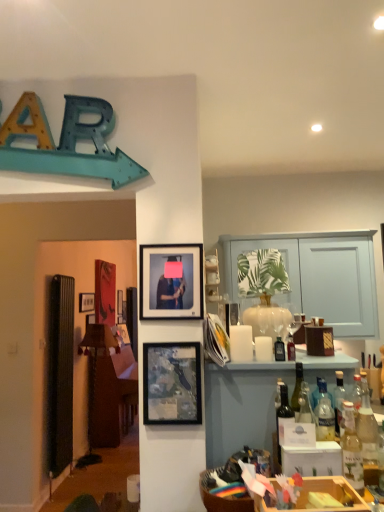
Question: Can you confirm if translucent glass bottles at right is taller than translucent glass bottle at right, which appears as the 4th bottle when viewed from the back?

Choices:
 (A) no
 (B) yes

Answer: (B)

Question: Considering the relative positions of translucent glass bottles at right and translucent glass bottle at right, which appears as the 4th bottle when viewed from the back, in the image provided, is translucent glass bottles at right to the right of translucent glass bottle at right, which appears as the 4th bottle when viewed from the back, from the viewer's perspective?

Choices:
 (A) no
 (B) yes

Answer: (B)

Question: Considering the relative sizes of translucent glass bottles at right and translucent glass bottle at right, the fifth bottle positioned from the right, in the image provided, is translucent glass bottles at right bigger than translucent glass bottle at right, the fifth bottle positioned from the right,?

Choices:
 (A) no
 (B) yes

Answer: (B)

Question: Does translucent glass bottles at right have a smaller size compared to translucent glass bottle at right, the fifth bottle positioned from the right?

Choices:
 (A) no
 (B) yes

Answer: (A)

Question: From a real-world perspective, is translucent glass bottles at right over translucent glass bottle at right, placed as the first bottle when sorted from left to right?

Choices:
 (A) no
 (B) yes

Answer: (A)

Question: From a real-world perspective, relative to translucent glass bottles at right, is matte glass picture frame at center, the 3th picture frame positioned from the back, vertically above or below?

Choices:
 (A) below
 (B) above

Answer: (B)

Question: Considering the positions of matte glass picture frame at center, the 1th picture frame viewed from the front, and translucent glass bottles at right in the image, is matte glass picture frame at center, the 1th picture frame viewed from the front, wider or thinner than translucent glass bottles at right?

Choices:
 (A) thin
 (B) wide

Answer: (A)

Question: Is point (178, 402) closer or farther from the camera than point (309, 274)?

Choices:
 (A) closer
 (B) farther

Answer: (A)

Question: Based on their positions, is matte glass picture frame at center, which appears as the 1th picture frame when viewed from the right, located to the left or right of translucent glass bottles at right?

Choices:
 (A) right
 (B) left

Answer: (B)

Question: Is point (297, 375) closer or farther from the camera than point (283, 354)?

Choices:
 (A) farther
 (B) closer

Answer: (B)

Question: In the image, is green glass wine bottle at center positioned in front of or behind matte glass bottle at center, which is counted as the fifth bottle, starting from the front?

Choices:
 (A) front
 (B) behind

Answer: (A)

Question: Is green glass wine bottle at center wider or thinner than matte glass bottle at center, which appears as the fourth bottle when viewed from the right?

Choices:
 (A) wide
 (B) thin

Answer: (B)

Question: Which is correct: green glass wine bottle at center is inside matte glass bottle at center, which is counted as the fifth bottle, starting from the front, or outside of it?

Choices:
 (A) inside
 (B) outside

Answer: (B)

Question: From a real-world perspective, relative to matte black picture frame at upper left, the 3th picture frame positioned from the front, is matte glass bottle at center, which is the second bottle from left to right, vertically above or below?

Choices:
 (A) below
 (B) above

Answer: (A)

Question: Is matte glass bottle at center, which appears as the fourth bottle when viewed from the right, inside the boundaries of matte black picture frame at upper left, the 3th picture frame positioned from the front, or outside?

Choices:
 (A) inside
 (B) outside

Answer: (B)